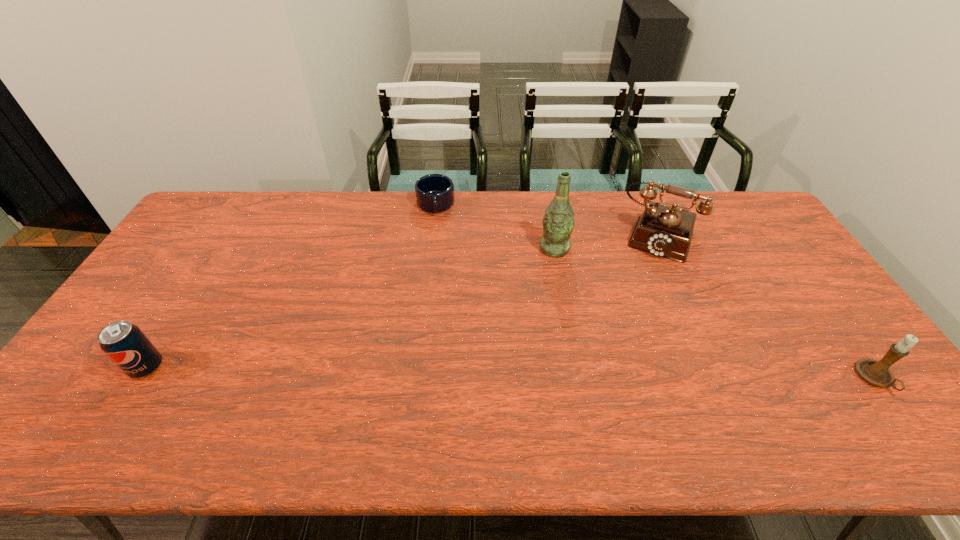
The image size is (960, 540). Find the location of `soda can situated at the near edge`. soda can situated at the near edge is located at coordinates (125, 344).

Where is `candle holder present at the near edge`? candle holder present at the near edge is located at coordinates (878, 373).

The width and height of the screenshot is (960, 540). In order to click on object present at the left edge in this screenshot , I will do point(125,344).

Find the location of `object at the right edge`. object at the right edge is located at coordinates (878, 373).

Locate an element on the screen. This screenshot has width=960, height=540. object at the near left corner is located at coordinates (125, 344).

You are a GUI agent. You are given a task and a screenshot of the screen. Output one action in this format:
    pyautogui.click(x=<x>, y=<y>)
    Task: Click on the object present at the near right corner
    
    Given the screenshot: What is the action you would take?
    coord(878,373)

This screenshot has height=540, width=960. I want to click on vacant space at the far edge of the desktop, so click(x=278, y=201).

Image resolution: width=960 pixels, height=540 pixels. In the image, there is a desktop. Identify the location of vacant space at the left edge. (172, 275).

You are a GUI agent. You are given a task and a screenshot of the screen. Output one action in this format:
    pyautogui.click(x=<x>, y=<y>)
    Task: Click on the vacant region at the right edge of the desktop
    The width and height of the screenshot is (960, 540).
    Given the screenshot: What is the action you would take?
    pyautogui.click(x=854, y=355)

At what (x,y) coordinates should I click in order to perform the action: click on free location at the far left corner of the desktop. Please return your answer as a coordinate pair (x, y). Looking at the image, I should click on (211, 221).